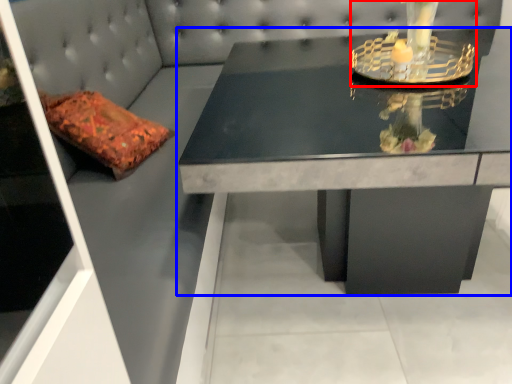
Question: Which point is further to the camera, candle holder (highlighted by a red box) or table (highlighted by a blue box)?

Choices:
 (A) candle holder
 (B) table

Answer: (A)